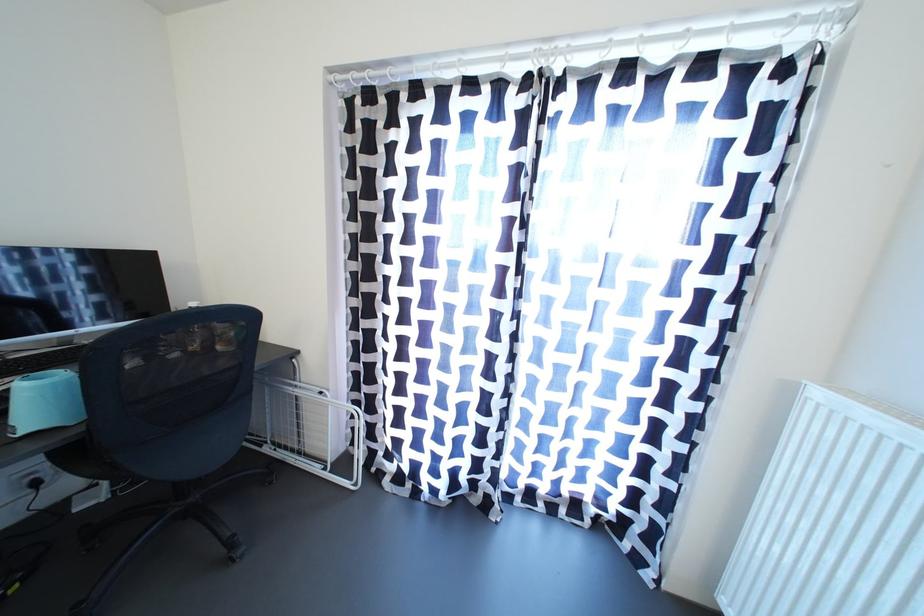
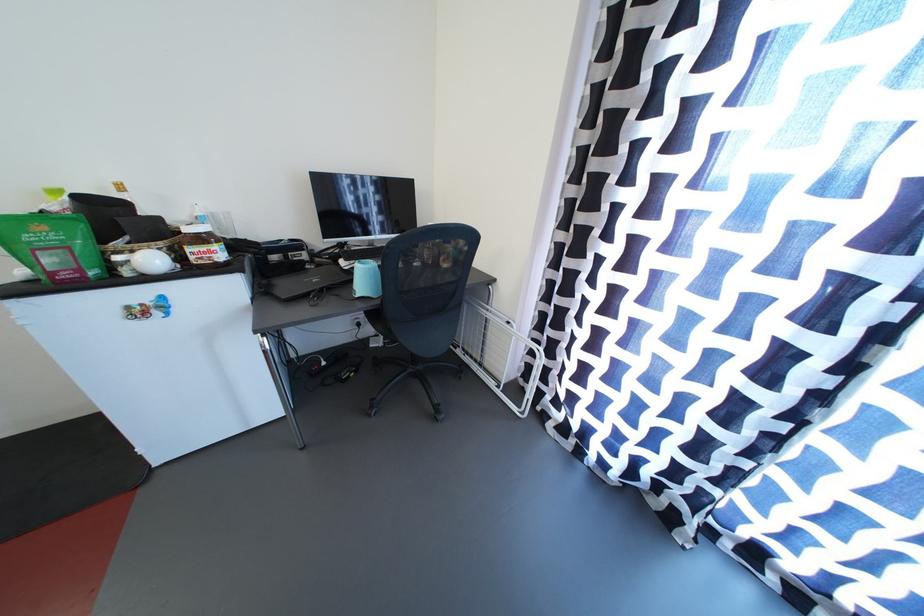
Locate, in the second image, the point that corresponds to point (333, 480) in the first image.

(505, 397)